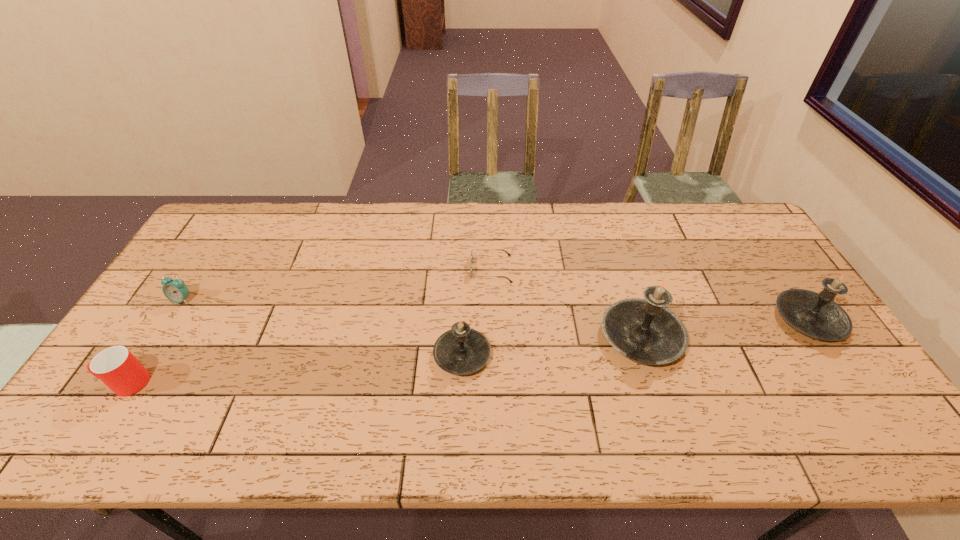
This screenshot has height=540, width=960. Find the location of `free space that satisfies the following two spatial constraints: 1. on the side of the cup with the handle; 2. on the left side of the second tallest candle`. free space that satisfies the following two spatial constraints: 1. on the side of the cup with the handle; 2. on the left side of the second tallest candle is located at coordinates (167, 319).